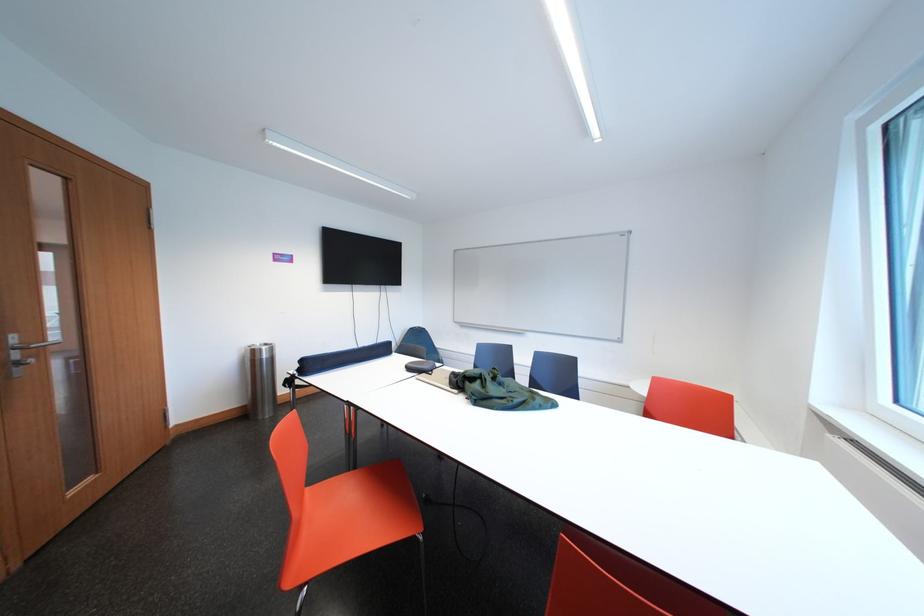
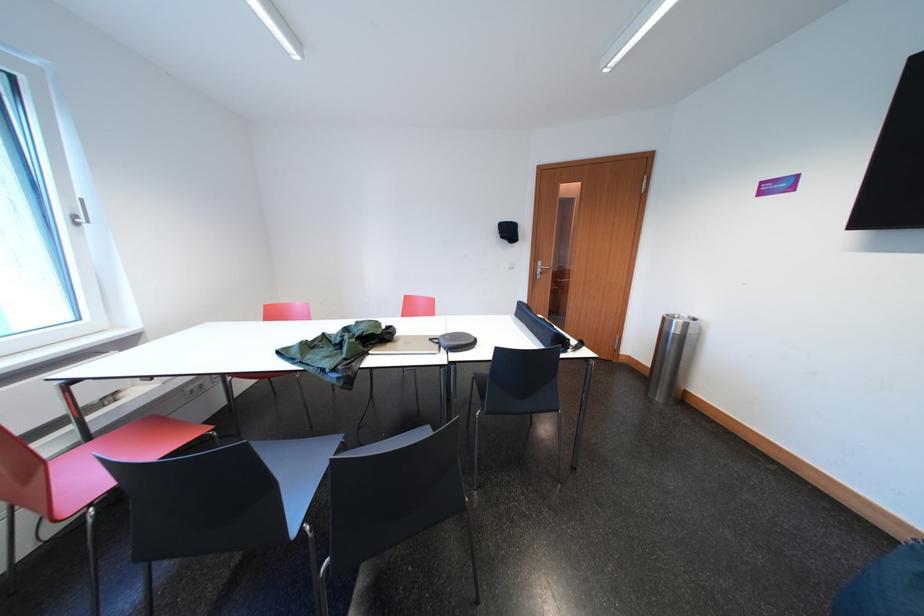
Question: I am providing you with two images of the same scene from different viewpoints. Which of the following objects are not visible in image2?

Choices:
 (A) silver door handle
 (B) striped tote bag
 (C) silver window handle
 (D) red chair sitting surface

Answer: (D)